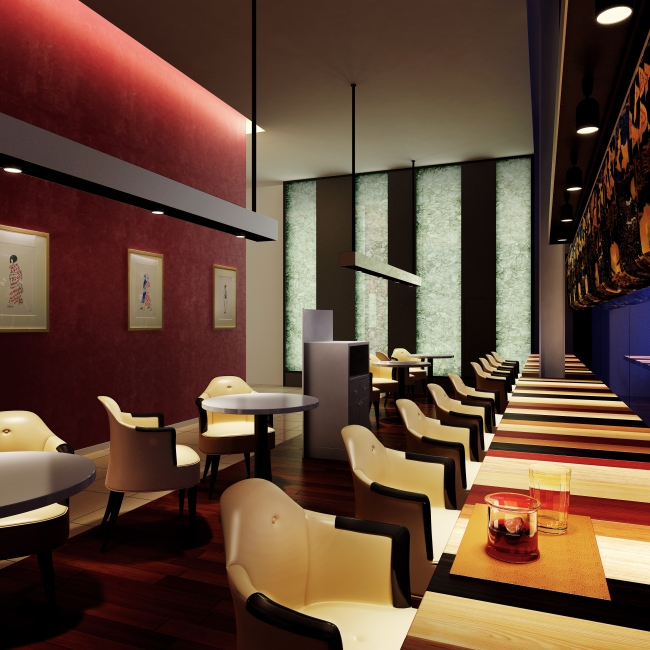
This screenshot has height=650, width=650. Identify the location of long table. (606, 437).